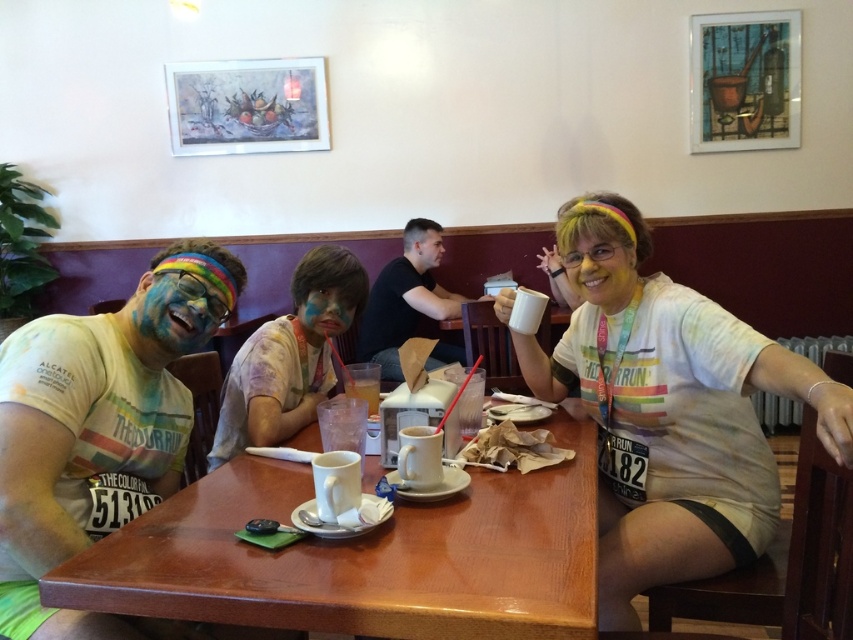
Question: Is white t-shirt at center below brown crumpled paper at table center?

Choices:
 (A) yes
 (B) no

Answer: (B)

Question: Which point is farther from the camera taking this photo?

Choices:
 (A) (224, 292)
 (B) (761, 451)
 (C) (167, 288)
 (D) (494, 580)

Answer: (B)

Question: From the image, what is the correct spatial relationship of rainbow paint face at center in relation to blue matte face paint at center?

Choices:
 (A) left
 (B) right

Answer: (A)

Question: Which point is closer to the camera?

Choices:
 (A) white t-shirt at center
 (B) translucent plastic cup at center
 (C) black t-shirt at center
 (D) brown crumpled paper at table center

Answer: (A)

Question: Based on their relative distances, which object is nearer to the white t-shirt at center?

Choices:
 (A) wooden table at center
 (B) black t-shirt at center
 (C) white matte t-shirt at center
 (D) brown crumpled paper at table center

Answer: (A)

Question: Does white matte face at upper center appear over translucent plastic cup at center?

Choices:
 (A) yes
 (B) no

Answer: (A)